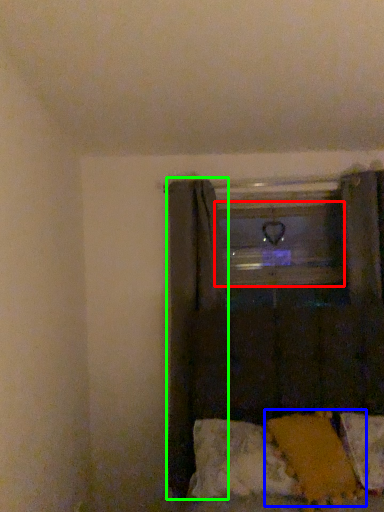
Question: Which object is the closest to the window frame (highlighted by a red box)? Choose among these: pillow (highlighted by a blue box) or curtain (highlighted by a green box).

Choices:
 (A) pillow
 (B) curtain

Answer: (B)